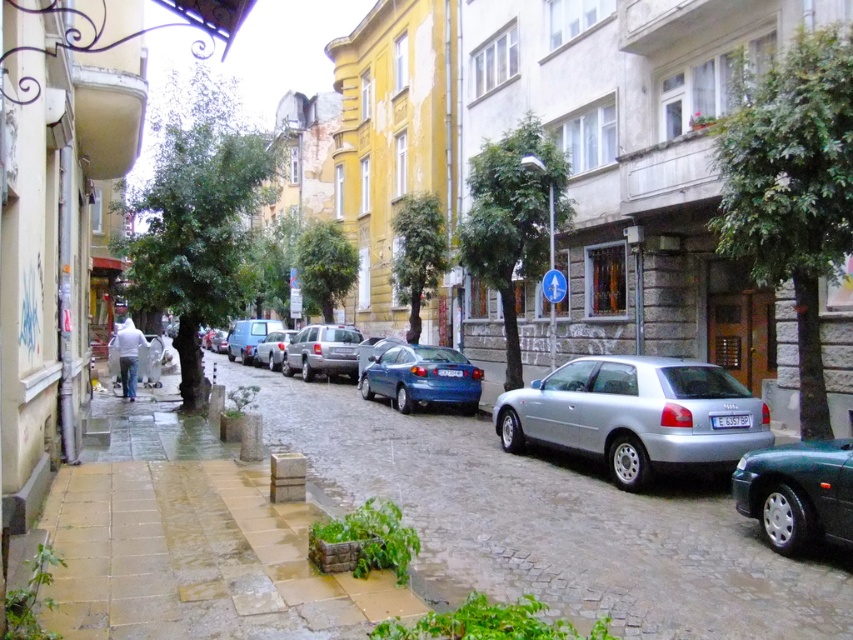
You are a delivery person trying to park your van between the glossy blue sedan at center and the silver metallic hatchback at center. Can you fit your van, which is 2 meters wide, in the space between them?

The glossy blue sedan at center is positioned under the silver metallic hatchback at center, which means they are stacked vertically. There is no horizontal space between them for the van to fit.

You are a delivery driver who needs to park your vehicle in a parking spot located between the glossy blue sedan at center and the silver metallic hatchback at center. The parking spot is 1.8 meters tall. Can your vehicle fit vertically in this space?

The glossy blue sedan at center is taller than the silver metallic hatchback at center. Since the parking spot is 1.8 meters tall, the vehicle must be shorter than 1.8 meters. However, without knowing the exact height of either car, it is impossible to determine if the space is sufficient. Please check the height of both vehicles before proceeding.